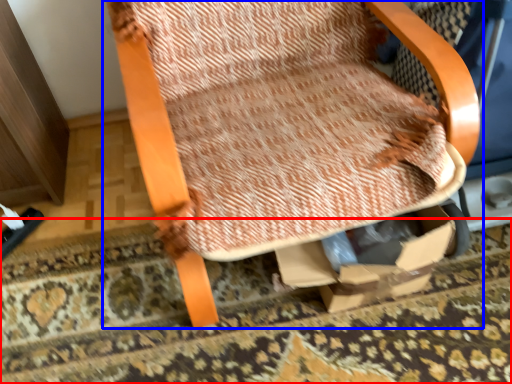
Question: Among these objects, which one is farthest to the camera, mat (highlighted by a red box) or chair (highlighted by a blue box)?

Choices:
 (A) mat
 (B) chair

Answer: (A)